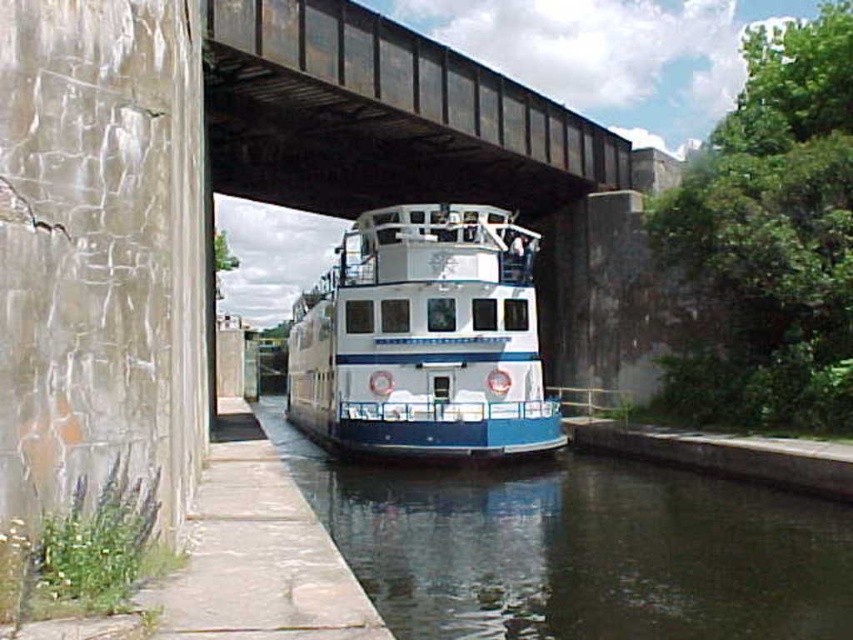
Question: Can you confirm if smooth dark water at center is wider than white glossy boat at center?

Choices:
 (A) no
 (B) yes

Answer: (A)

Question: Which of the following is the farthest from the observer?

Choices:
 (A) metal bridge at upper center
 (B) white glossy boat at center
 (C) smooth dark water at center

Answer: (B)

Question: Can you confirm if metal bridge at upper center is bigger than white glossy boat at center?

Choices:
 (A) yes
 (B) no

Answer: (B)

Question: Which of the following is the closest to the observer?

Choices:
 (A) metal bridge at upper center
 (B) smooth dark water at center

Answer: (B)

Question: Can you confirm if metal bridge at upper center is thinner than white glossy boat at center?

Choices:
 (A) no
 (B) yes

Answer: (B)

Question: Which of the following is the closest to the observer?

Choices:
 (A) smooth dark water at center
 (B) metal bridge at upper center
 (C) white glossy boat at center

Answer: (A)